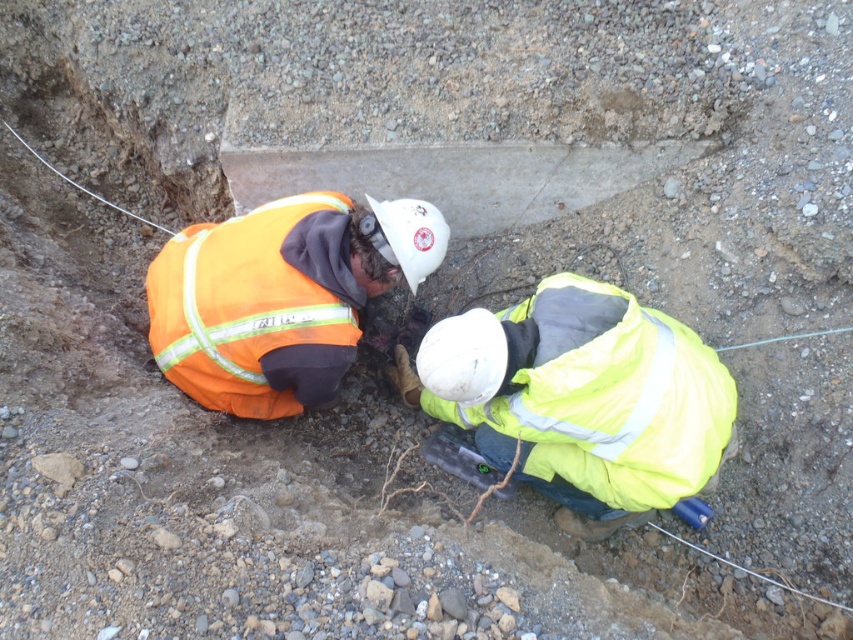
You are a safety inspector checking the distance between the yellow reflective jacket at center and the orange reflective safety vest at lower left. According to safety regulations, workers must be at least 24 inches apart to avoid collision risks. Is the current distance compliant with this requirement?

The yellow reflective jacket at center and orange reflective safety vest at lower left are 24.36 inches apart from each other, which exceeds the minimum required 24 inches. Therefore, the current distance complies with the safety regulations.

Based on the photo, based on the scene description, where is the yellow reflective jacket at center located in terms of coordinates?

The yellow reflective jacket at center is located at coordinates point (581, 396).

Two workers are working together in a construction site. They are both wearing hard hats and safety vests. One is wearing an orange vest and the other a yellow vest. The orange vest worker is at point (599,429). Can the yellow vest worker reach the orange vest worker without moving more than 6 feet?

The distance between the two workers is 6.49 feet, which is slightly more than 6 feet. Therefore, the yellow vest worker cannot reach the orange vest worker without moving more than 6 feet.